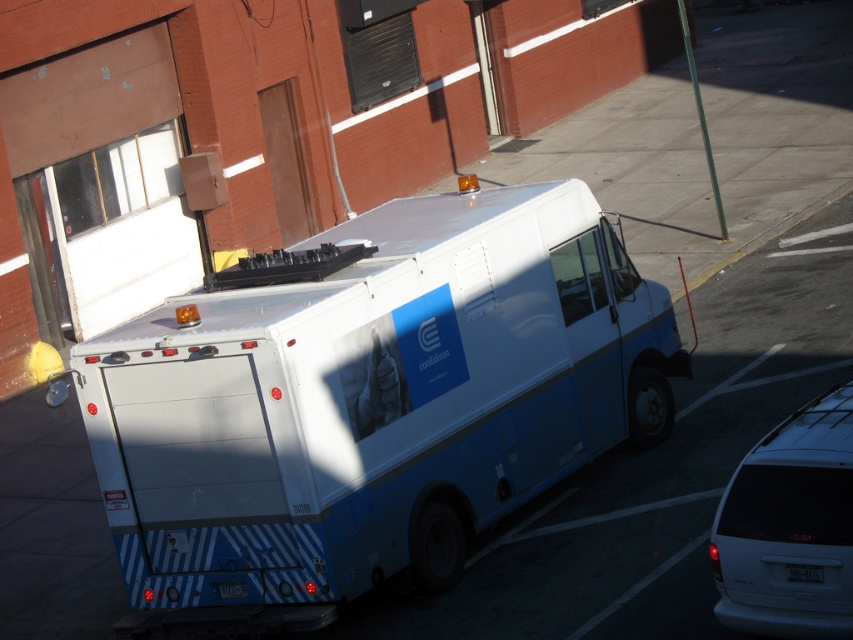
Question: Which is nearer to the white plastic license plate at rear?

Choices:
 (A) white matte van at lower right
 (B) black plastic license plate at center
 (C) white glossy van at center

Answer: (C)

Question: Does white glossy van at center have a smaller size compared to white plastic license plate at rear?

Choices:
 (A) yes
 (B) no

Answer: (B)

Question: Does white glossy van at center appear on the right side of white matte van at lower right?

Choices:
 (A) yes
 (B) no

Answer: (B)

Question: Which object is positioned farthest from the white glossy van at center?

Choices:
 (A) black plastic license plate at center
 (B) white plastic license plate at rear

Answer: (A)

Question: Is the position of white matte van at lower right less distant than that of white plastic license plate at rear?

Choices:
 (A) yes
 (B) no

Answer: (A)

Question: Which of the following is the closest to the observer?

Choices:
 (A) white plastic license plate at rear
 (B) white matte van at lower right
 (C) black plastic license plate at center
 (D) white glossy van at center

Answer: (B)